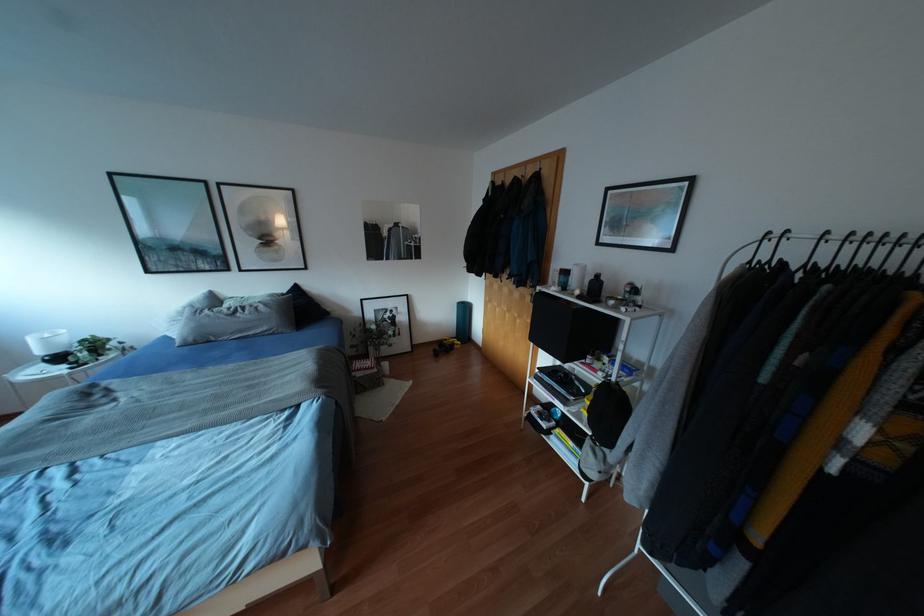
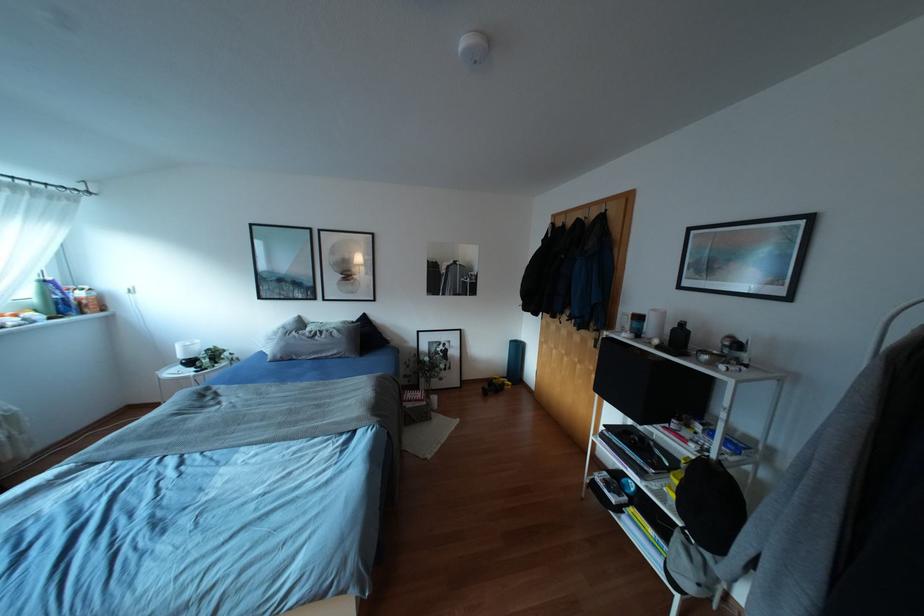
Question: The camera is either moving clockwise (left) or counter-clockwise (right) around the object. The first image is from the beginning of the video and the second image is from the end. Is the camera moving left or right when shooting the video?

Choices:
 (A) Left
 (B) Right

Answer: (B)